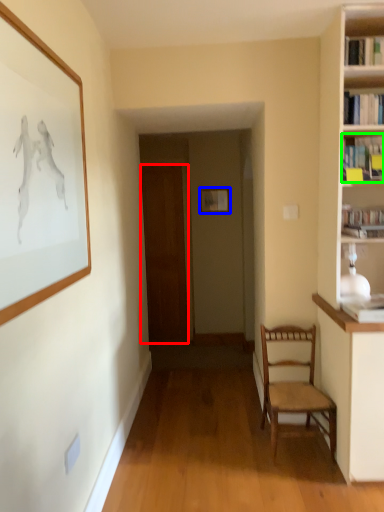
Question: Considering the real-world distances, which object is closest to door (highlighted by a red box)? picture frame (highlighted by a blue box) or book (highlighted by a green box).

Choices:
 (A) picture frame
 (B) book

Answer: (A)